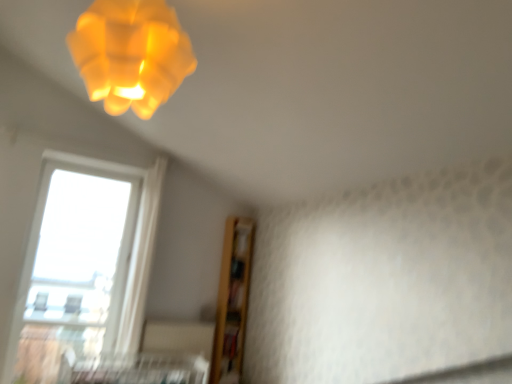
Question: Would you say metallic silver bed frame at lower center contains transparent glass window at lower left?

Choices:
 (A) no
 (B) yes

Answer: (A)

Question: Considering the relative sizes of metallic silver bed frame at lower center and transparent glass window at lower left in the image provided, is metallic silver bed frame at lower center thinner than transparent glass window at lower left?

Choices:
 (A) no
 (B) yes

Answer: (A)

Question: Is metallic silver bed frame at lower center positioned beyond the bounds of transparent glass window at lower left?

Choices:
 (A) yes
 (B) no

Answer: (A)

Question: From a real-world perspective, is metallic silver bed frame at lower center positioned over transparent glass window at lower left based on gravity?

Choices:
 (A) yes
 (B) no

Answer: (B)

Question: From the image's perspective, is metallic silver bed frame at lower center below transparent glass window at lower left?

Choices:
 (A) yes
 (B) no

Answer: (A)

Question: From the image's perspective, is metallic silver bed frame at lower center over transparent glass window at lower left?

Choices:
 (A) no
 (B) yes

Answer: (A)

Question: Is transparent glass window at lower left smaller than matte yellow plastic lamp at upper left?

Choices:
 (A) no
 (B) yes

Answer: (A)

Question: From a real-world perspective, is transparent glass window at lower left on top of matte yellow plastic lamp at upper left?

Choices:
 (A) yes
 (B) no

Answer: (B)

Question: Could you tell me if transparent glass window at lower left is facing matte yellow plastic lamp at upper left?

Choices:
 (A) yes
 (B) no

Answer: (A)

Question: Is matte yellow plastic lamp at upper left inside transparent glass window at lower left?

Choices:
 (A) yes
 (B) no

Answer: (B)

Question: Are transparent glass window at lower left and matte yellow plastic lamp at upper left making contact?

Choices:
 (A) no
 (B) yes

Answer: (A)

Question: Is transparent glass window at lower left shorter than matte yellow plastic lamp at upper left?

Choices:
 (A) no
 (B) yes

Answer: (A)

Question: From a real-world perspective, is matte yellow plastic lamp at upper left on top of metallic silver bed frame at lower center?

Choices:
 (A) no
 (B) yes

Answer: (B)